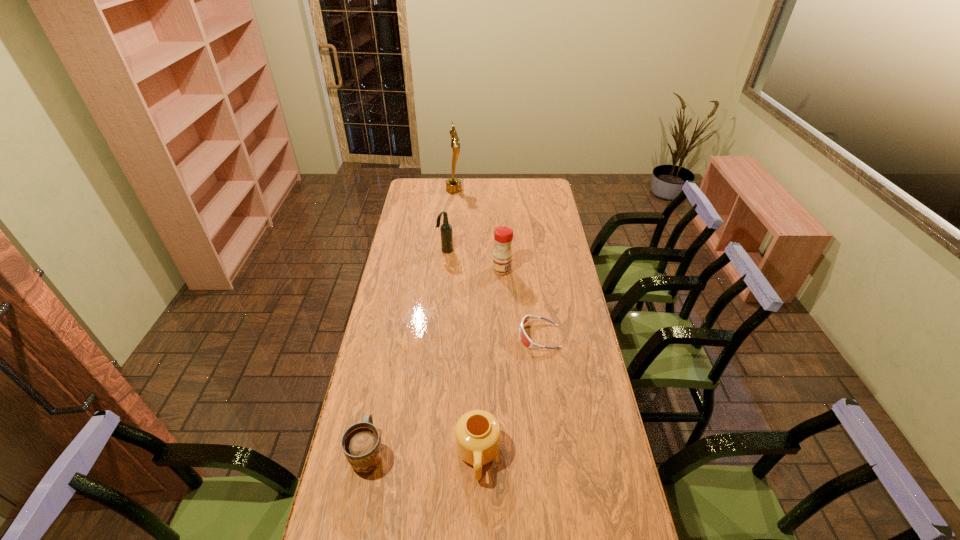
Where is `object located at the right edge`? Image resolution: width=960 pixels, height=540 pixels. object located at the right edge is located at coordinates (524, 338).

In the image, there is a desktop. Identify the location of blank space at the far edge. The width and height of the screenshot is (960, 540). (457, 196).

The height and width of the screenshot is (540, 960). I want to click on vacant space at the left edge of the desktop, so click(x=421, y=270).

This screenshot has width=960, height=540. Identify the location of free space at the right edge. (612, 427).

In the image, there is a desktop. Where is `vacant area at the far right corner`? The width and height of the screenshot is (960, 540). vacant area at the far right corner is located at coordinates (546, 190).

Find the location of `empty space that is in between the condiment and the left mug`. empty space that is in between the condiment and the left mug is located at coordinates (435, 361).

Where is `vacant area that lies between the third farthest object and the leftmost object`? This screenshot has width=960, height=540. vacant area that lies between the third farthest object and the leftmost object is located at coordinates (435, 361).

Where is `free space that is in between the leftmost object and the rightmost object`? free space that is in between the leftmost object and the rightmost object is located at coordinates (454, 394).

Locate an element on the screen. free space between the fourth nearest object and the third nearest object is located at coordinates (520, 303).

Locate an element on the screen. This screenshot has height=540, width=960. free space between the condiment and the second farthest object is located at coordinates (473, 260).